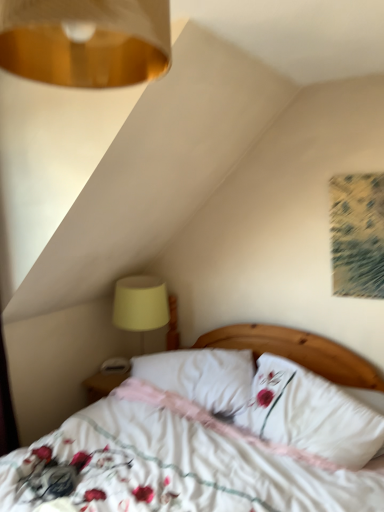
Question: Looking at the image, does yellow fabric lampshade at lower left seem bigger or smaller compared to gold metallic lampshade at upper left?

Choices:
 (A) big
 (B) small

Answer: (A)

Question: From the image's perspective, is yellow fabric lampshade at lower left positioned above or below gold metallic lampshade at upper left?

Choices:
 (A) above
 (B) below

Answer: (B)

Question: Which object is the farthest from the gold metallic lampshade at upper left?

Choices:
 (A) white soft pillow at center, the 1th pillow positioned from the right
 (B) printed fabric artwork at upper right
 (C) yellow fabric lampshade at lower left
 (D) white soft pillow at center, the 2th pillow when ordered from right to left
 (E) white floral fabric bed at center

Answer: (C)

Question: Considering the real-world distances, which object is farthest from the white soft pillow at center, the 2th pillow from the left?

Choices:
 (A) printed fabric artwork at upper right
 (B) gold metallic lampshade at upper left
 (C) white floral fabric bed at center
 (D) white soft pillow at center, the 2th pillow when ordered from right to left
 (E) yellow fabric lampshade at lower left

Answer: (B)